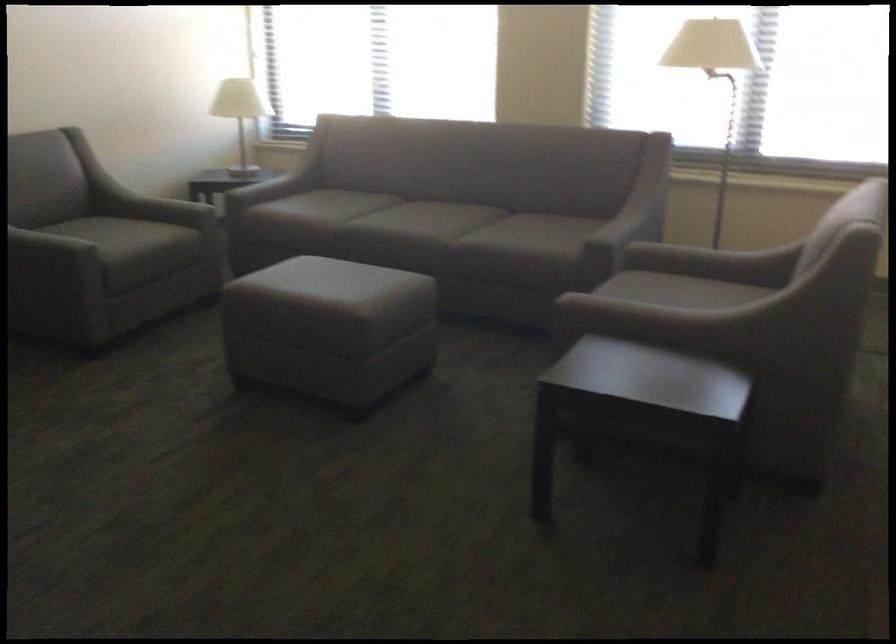
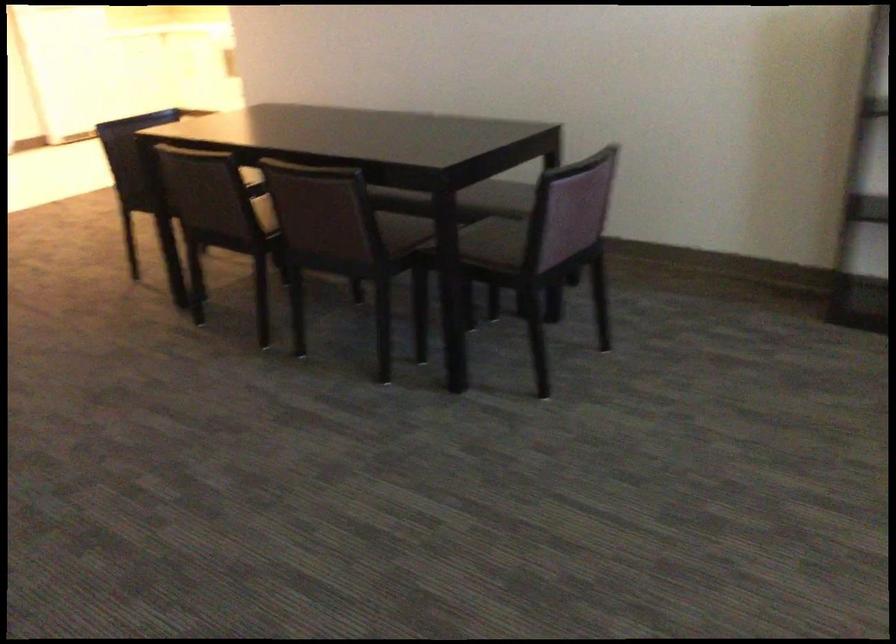
Based on the continuous images, in which direction is the camera rotating?

The rotation direction of the camera is left-down.